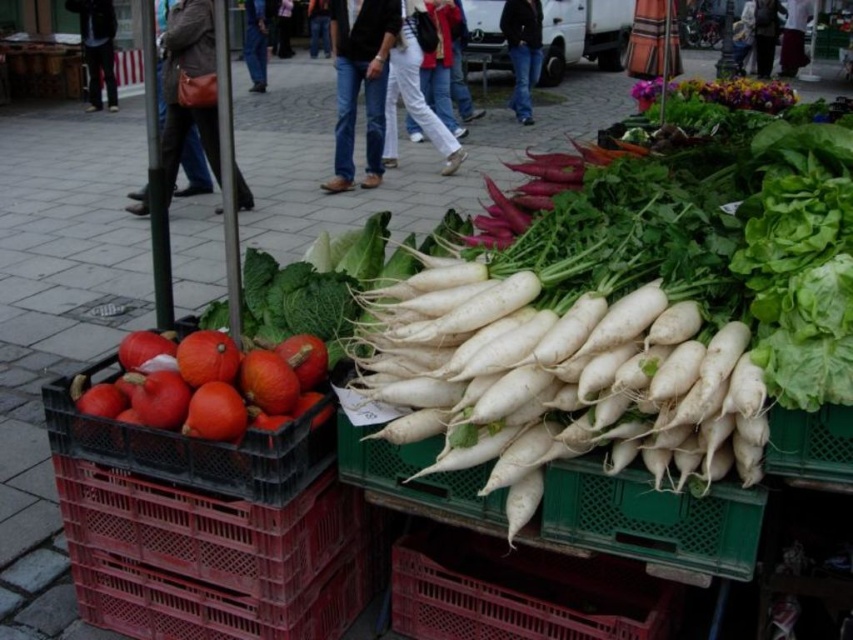
Question: Which object is the closest to the orange matte pumpkin at left?

Choices:
 (A) matte plastic basket at lower center
 (B) white smooth radish at center

Answer: (A)

Question: Does white smooth radish at center have a larger size compared to orange matte pumpkin at left?

Choices:
 (A) no
 (B) yes

Answer: (B)

Question: Can you confirm if matte plastic basket at lower center is bigger than orange matte pumpkin at left?

Choices:
 (A) yes
 (B) no

Answer: (A)

Question: Estimate the real-world distances between objects in this image. Which object is closer to the matte plastic basket at lower center?

Choices:
 (A) orange matte pumpkin at left
 (B) white smooth radish at center

Answer: (A)

Question: Can you confirm if white smooth radish at center is bigger than orange matte pumpkin at left?

Choices:
 (A) no
 (B) yes

Answer: (B)

Question: Which of the following is the farthest from the observer?

Choices:
 (A) (543, 419)
 (B) (416, 621)
 (C) (189, 364)

Answer: (B)